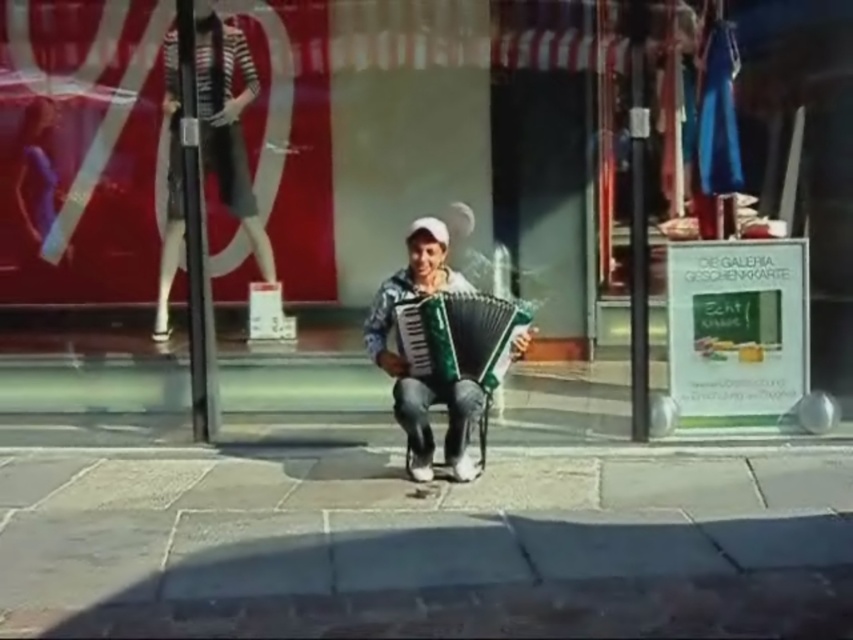
Is gray stone pavement at center shorter than green plastic accordion at center?

Indeed, gray stone pavement at center has a lesser height compared to green plastic accordion at center.

Can you confirm if gray stone pavement at center is positioned to the right of green plastic accordion at center?

Incorrect, gray stone pavement at center is not on the right side of green plastic accordion at center.

Based on the photo, measure the distance between point (585,604) and camera.

Point (585,604) is 9.17 feet away from camera.

The image size is (853, 640). I want to click on gray stone pavement at center, so click(x=425, y=545).

Is green plastic sign at center positioned behind gray stone pavement at center?

Yes, it is behind gray stone pavement at center.

Can you confirm if green plastic sign at center is shorter than gray stone pavement at center?

No.

You are a GUI agent. You are given a task and a screenshot of the screen. Output one action in this format:
    pyautogui.click(x=<x>, y=<y>)
    Task: Click on the green plastic sign at center
    Image resolution: width=853 pixels, height=640 pixels.
    Given the screenshot: What is the action you would take?
    pyautogui.click(x=448, y=148)

Does point (427, 195) come in front of point (460, 371)?

No, it is not.

Can you confirm if green plastic sign at center is bigger than green plastic accordion at center?

Yes, green plastic sign at center is bigger than green plastic accordion at center.

What do you see at coordinates (448, 148) in the screenshot? This screenshot has width=853, height=640. I see `green plastic sign at center` at bounding box center [448, 148].

Where is `green plastic sign at center`? This screenshot has height=640, width=853. green plastic sign at center is located at coordinates (448, 148).